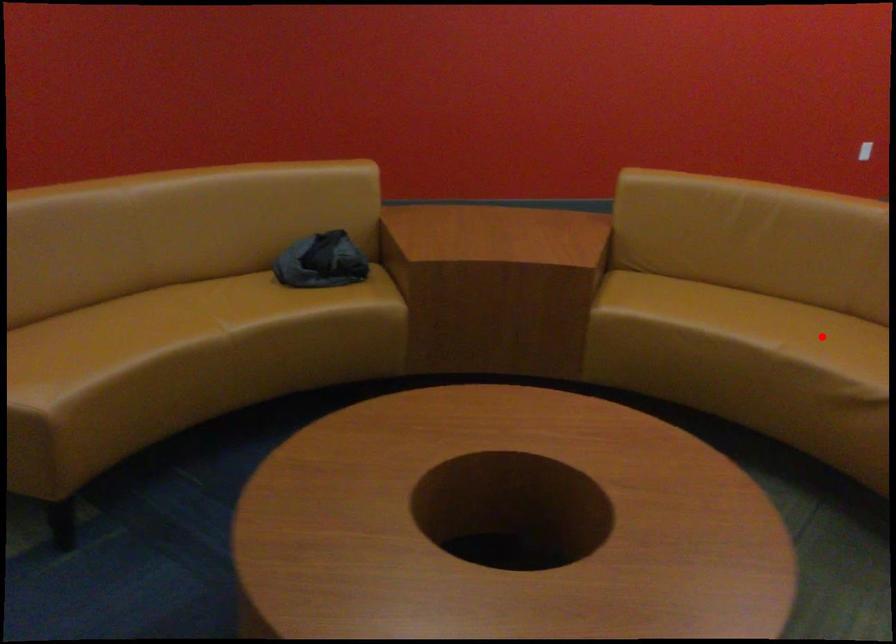
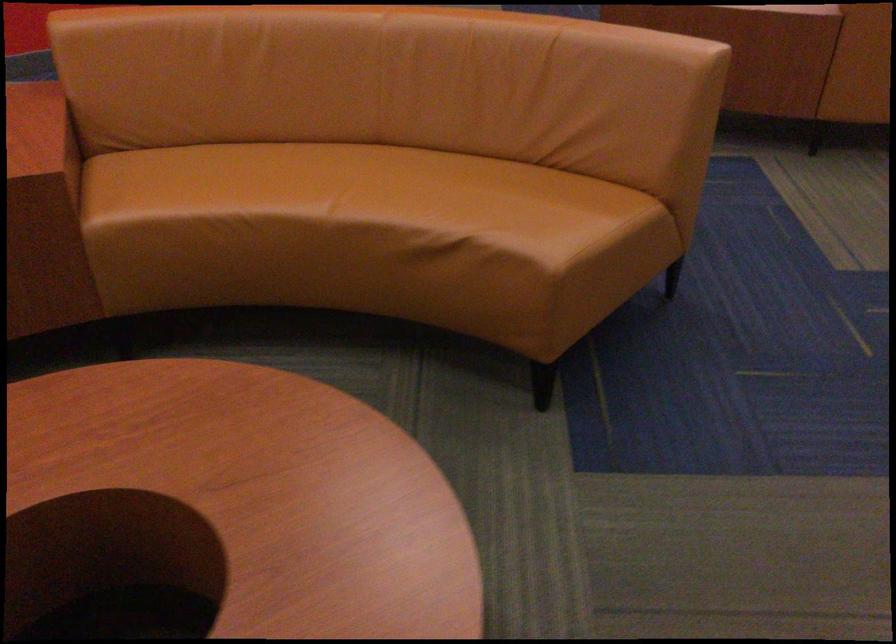
Question: I am providing you with two images of the same scene from different viewpoints. In image1, a red point is highlighted. Considering the same 3D point in image2, which of the following is correct?

Choices:
 (A) It is closer
 (B) It is farther

Answer: (A)